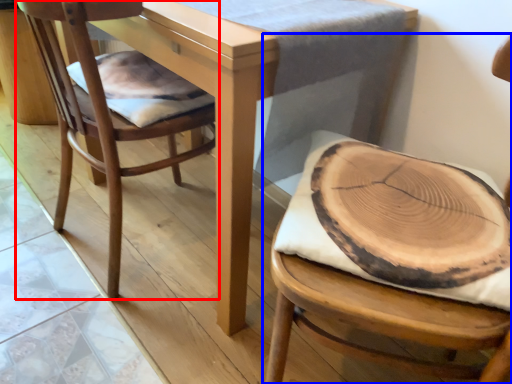
Question: Among these objects, which one is nearest to the camera, chair (highlighted by a red box) or chair (highlighted by a blue box)?

Choices:
 (A) chair
 (B) chair

Answer: (B)